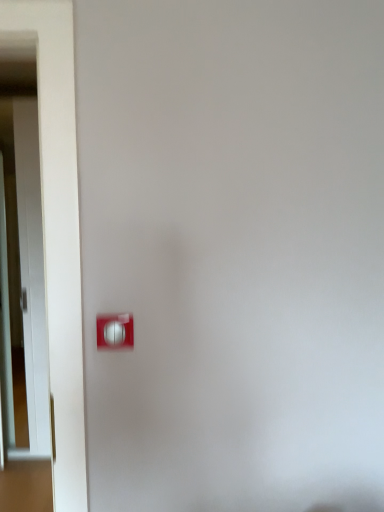
What do you see at coordinates (23, 280) in the screenshot?
I see `white glossy door at left` at bounding box center [23, 280].

Where is `white glossy door at left`? white glossy door at left is located at coordinates (23, 280).

Identify the location of white plastic light switch at lower left. Image resolution: width=384 pixels, height=512 pixels. (115, 331).

What do you see at coordinates (115, 331) in the screenshot? I see `white plastic light switch at lower left` at bounding box center [115, 331].

Identify the location of white glossy door at left. (23, 280).

Between white plastic light switch at lower left and white glossy door at left, which one appears on the left side from the viewer's perspective?

white glossy door at left.

Which object is further away from the camera, white plastic light switch at lower left or white glossy door at left?

white glossy door at left is further from the camera.

Is point (123, 316) positioned before point (35, 169)?

Yes, point (123, 316) is closer to viewer.

From the image's perspective, which object appears higher, white plastic light switch at lower left or white glossy door at left?

white glossy door at left is shown above in the image.

From a real-world perspective, between white plastic light switch at lower left and white glossy door at left, who is vertically higher?

white plastic light switch at lower left.

Is white plastic light switch at lower left thinner than white glossy door at left?

Correct, the width of white plastic light switch at lower left is less than that of white glossy door at left.

Between white plastic light switch at lower left and white glossy door at left, which one has less height?

white plastic light switch at lower left is shorter.

In the scene shown: Does white plastic light switch at lower left have a larger size compared to white glossy door at left?

No, white plastic light switch at lower left is not bigger than white glossy door at left.

Could white glossy door at left be considered to be inside white plastic light switch at lower left?

No, white glossy door at left is not surrounded by white plastic light switch at lower left.

Is the surface of white plastic light switch at lower left in direct contact with white glossy door at left?

They are not placed beside each other.

Could you tell me if white plastic light switch at lower left is turned towards white glossy door at left?

No, white plastic light switch at lower left does not turn towards white glossy door at left.

Consider the image. What's the angular difference between white plastic light switch at lower left and white glossy door at left's facing directions?

The angle between the facing direction of white plastic light switch at lower left and the facing direction of white glossy door at left is 1.38 degrees.

Measure the distance between white plastic light switch at lower left and white glossy door at left.

white plastic light switch at lower left and white glossy door at left are 6.91 feet apart from each other.

At what (x,y) coordinates should I click in order to perform the action: click on door lying above the white plastic light switch at lower left (from the image's perspective). Please return your answer as a coordinate pair (x, y). Image resolution: width=384 pixels, height=512 pixels. Looking at the image, I should click on (23, 280).

Does white glossy door at left appear on the left side of white plastic light switch at lower left?

Yes, white glossy door at left is to the left of white plastic light switch at lower left.

From the picture: Is white glossy door at left in front of white plastic light switch at lower left?

No, the depth of white glossy door at left is greater than that of white plastic light switch at lower left.

Is point (27, 313) closer or farther from the camera than point (119, 336)?

Clearly, point (27, 313) is more distant from the camera than point (119, 336).

From the image's perspective, between white glossy door at left and white plastic light switch at lower left, which one is located above?

white glossy door at left.

From a real-world perspective, is white glossy door at left positioned over white plastic light switch at lower left based on gravity?

No, from a real-world perspective, white glossy door at left is not on top of white plastic light switch at lower left.

Is white glossy door at left thinner than white plastic light switch at lower left?

In fact, white glossy door at left might be wider than white plastic light switch at lower left.

Is white glossy door at left taller or shorter than white plastic light switch at lower left?

white glossy door at left is taller than white plastic light switch at lower left.

Which of these two, white glossy door at left or white plastic light switch at lower left, is smaller?

With smaller size is white plastic light switch at lower left.

Is white glossy door at left spatially inside white plastic light switch at lower left, or outside of it?

white glossy door at left exists outside the volume of white plastic light switch at lower left.

Are white glossy door at left and white plastic light switch at lower left located far from each other?

white glossy door at left is positioned a significant distance from white plastic light switch at lower left.

Is white glossy door at left facing towards white plastic light switch at lower left?

No, white glossy door at left does not turn towards white plastic light switch at lower left.

How different are the orientations of white glossy door at left and white plastic light switch at lower left in degrees?

They differ by 1.38 degrees in their facing directions.

Locate an element on the screen. light switch lying on the right of white glossy door at left is located at coordinates (115, 331).

Locate an element on the screen. This screenshot has height=512, width=384. light switch that appears in front of the white glossy door at left is located at coordinates (115, 331).

The image size is (384, 512). I want to click on door lying behind the white plastic light switch at lower left, so click(23, 280).